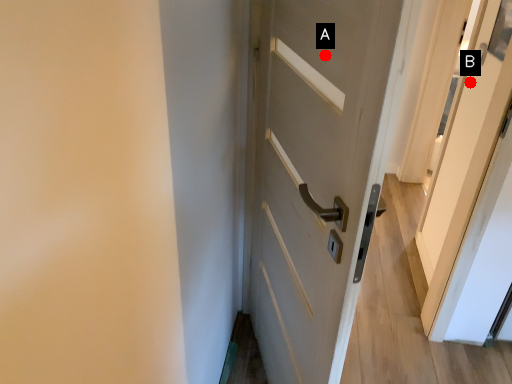
Question: Two points are circled on the image, labeled by A and B beside each circle. Which point is closer to the camera?

Choices:
 (A) A is closer
 (B) B is closer

Answer: (A)